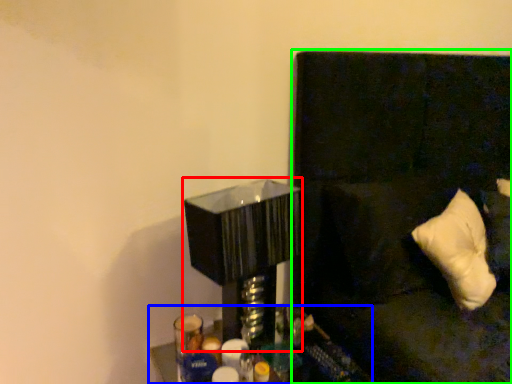
Question: Estimate the real-world distances between objects in this image. Which object is farther from table lamp (highlighted by a red box), furniture (highlighted by a blue box) or couch (highlighted by a green box)?

Choices:
 (A) furniture
 (B) couch

Answer: (B)